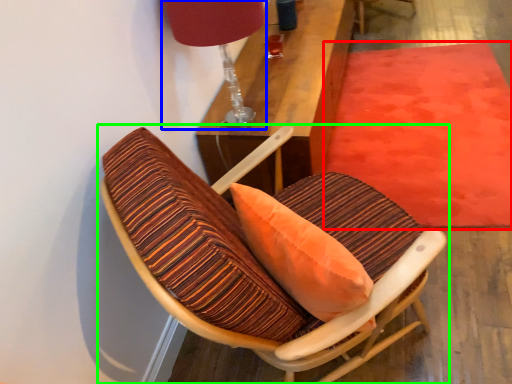
Question: Which object is positioned closest to mat (highlighted by a red box)? Select from table lamp (highlighted by a blue box) and chair (highlighted by a green box).

Choices:
 (A) table lamp
 (B) chair

Answer: (B)